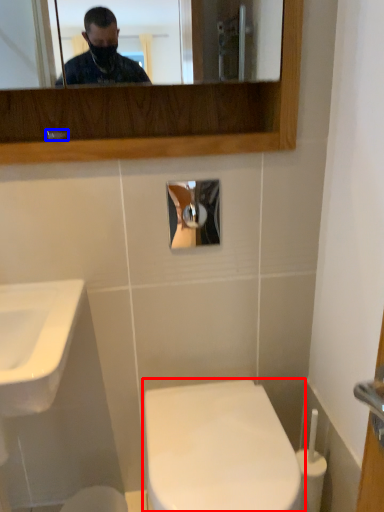
Question: Which object appears farthest to the camera in this image, toilet (highlighted by a red box) or faucet (highlighted by a blue box)?

Choices:
 (A) toilet
 (B) faucet

Answer: (B)